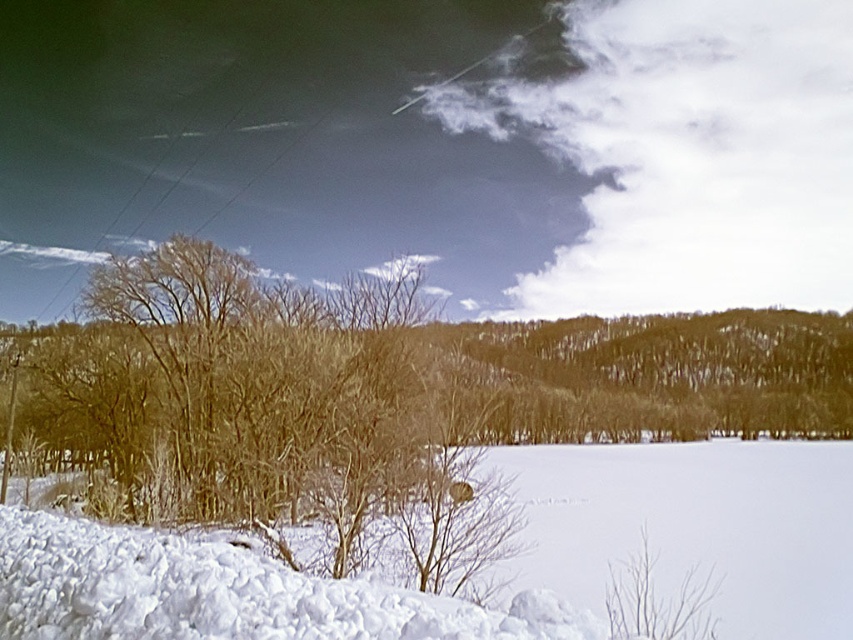
Based on the scene description, can you identify the object located at the coordinates point (270,417)?

The point (270,417) corresponds to the brown textured tree at left.

You are standing in the winter landscape and want to walk towards the brown textured tree at left. Will the white fluffy snow at lower left be in your path?

The brown textured tree at left is further to the viewer than white fluffy snow at lower left, so the white fluffy snow at lower left is behind the tree. Therefore, walking towards the tree would not require passing through the snow at lower left.